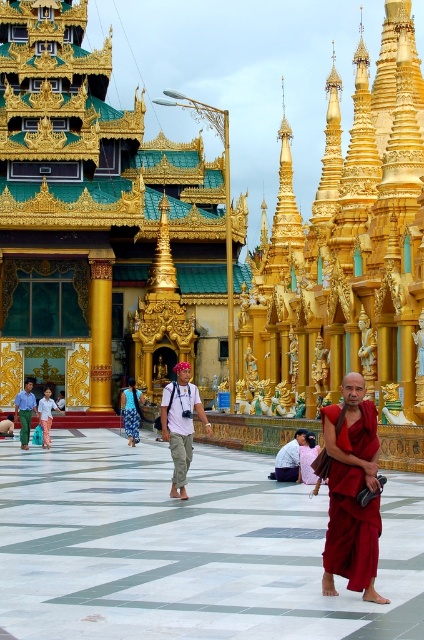
You are an anthropologist visiting the temple complex and need to describe the clothing of the man in the scene. Which of his garments has a narrower width when comparing the khaki pants at center and the light blue cotton shirt at center?

The khaki pants at center has a lesser width compared to the light blue cotton shirt at center, so the khaki pants at center is narrower.